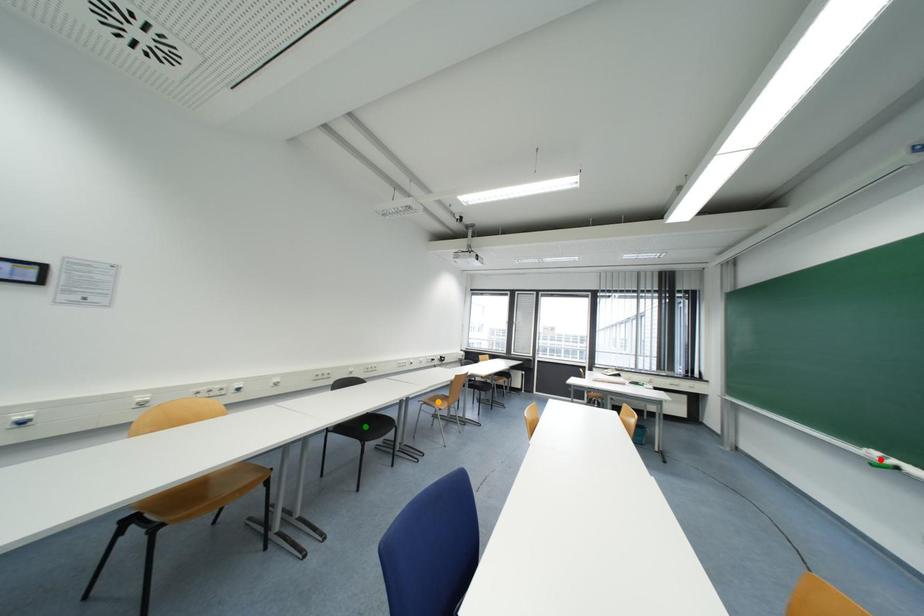
Order these from nearest to farthest:
A) red point
B) green point
C) orange point

orange point
green point
red point